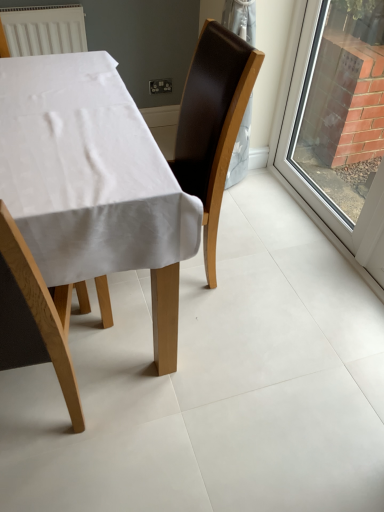
Image resolution: width=384 pixels, height=512 pixels. Find the location of `vacant space that's between white fabric-covered table at center and brown leather chair at center, the first chair positioned from the back`. vacant space that's between white fabric-covered table at center and brown leather chair at center, the first chair positioned from the back is located at coordinates (208, 318).